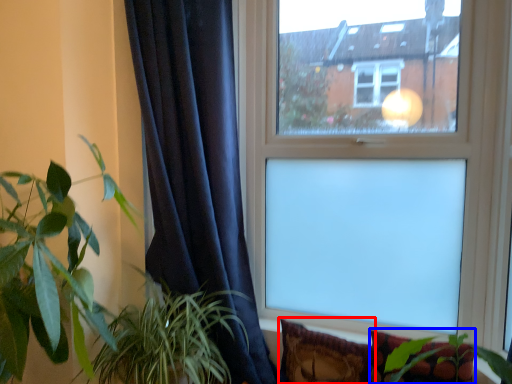
Question: Which object is closer to the camera taking this photo, pillow (highlighted by a red box) or pillow (highlighted by a blue box)?

Choices:
 (A) pillow
 (B) pillow

Answer: (B)